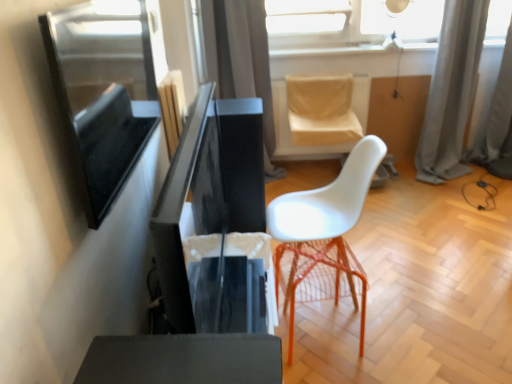
Question: Can you confirm if gray fabric curtain at upper right, acting as the 3th curtain starting from the left, is taller than matte black screen at left?

Choices:
 (A) yes
 (B) no

Answer: (A)

Question: From a real-world perspective, is gray fabric curtain at upper right, which is the 1th curtain from right to left, physically below matte black screen at left?

Choices:
 (A) yes
 (B) no

Answer: (A)

Question: Is gray fabric curtain at upper right, which is the 1th curtain from right to left, smaller than matte black screen at left?

Choices:
 (A) no
 (B) yes

Answer: (A)

Question: Does gray fabric curtain at upper right, which is the 1th curtain from right to left, have a lesser height compared to matte black screen at left?

Choices:
 (A) no
 (B) yes

Answer: (A)

Question: Could you tell me if gray fabric curtain at upper right, acting as the 3th curtain starting from the left, is facing matte black screen at left?

Choices:
 (A) yes
 (B) no

Answer: (B)

Question: Is gray fabric curtain at upper right, acting as the 3th curtain starting from the left, at the right side of matte black screen at left?

Choices:
 (A) yes
 (B) no

Answer: (A)

Question: Is satin gray curtain at upper center, which ranks as the third curtain in right-to-left order, located outside gray fabric curtain at upper right, which is the 2th curtain in right-to-left order?

Choices:
 (A) yes
 (B) no

Answer: (A)

Question: Does satin gray curtain at upper center, which ranks as the third curtain in right-to-left order, appear on the right side of gray fabric curtain at upper right, which is the second curtain in left-to-right order?

Choices:
 (A) no
 (B) yes

Answer: (A)

Question: Is satin gray curtain at upper center, which is the 1th curtain in left-to-right order, shorter than gray fabric curtain at upper right, which is the second curtain in left-to-right order?

Choices:
 (A) yes
 (B) no

Answer: (B)

Question: Is the depth of satin gray curtain at upper center, which ranks as the third curtain in right-to-left order, greater than that of gray fabric curtain at upper right, which is the 2th curtain in right-to-left order?

Choices:
 (A) no
 (B) yes

Answer: (A)

Question: From the image's perspective, is satin gray curtain at upper center, which ranks as the third curtain in right-to-left order, over gray fabric curtain at upper right, which is the second curtain in left-to-right order?

Choices:
 (A) yes
 (B) no

Answer: (B)

Question: Does satin gray curtain at upper center, which ranks as the third curtain in right-to-left order, have a larger size compared to gray fabric curtain at upper right, which is the second curtain in left-to-right order?

Choices:
 (A) no
 (B) yes

Answer: (B)

Question: Is transparent glass lampshade at upper center at the left side of matte black screen at left?

Choices:
 (A) yes
 (B) no

Answer: (B)